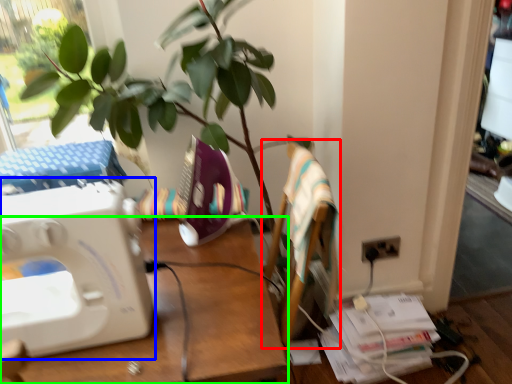
Question: Considering the real-world distances, which object is farthest from armchair (highlighted by a red box)? sewing machine (highlighted by a blue box) or desk (highlighted by a green box)?

Choices:
 (A) sewing machine
 (B) desk

Answer: (A)